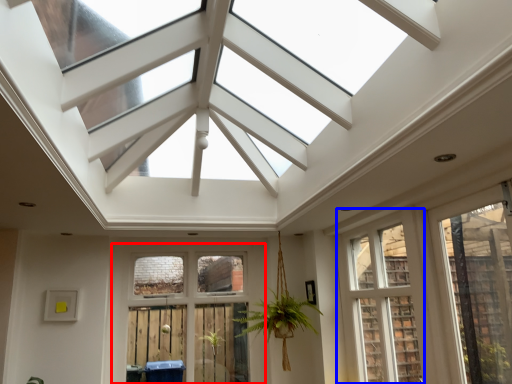
Question: Among these objects, which one is farthest to the camera, window (highlighted by a red box) or window (highlighted by a blue box)?

Choices:
 (A) window
 (B) window

Answer: (A)